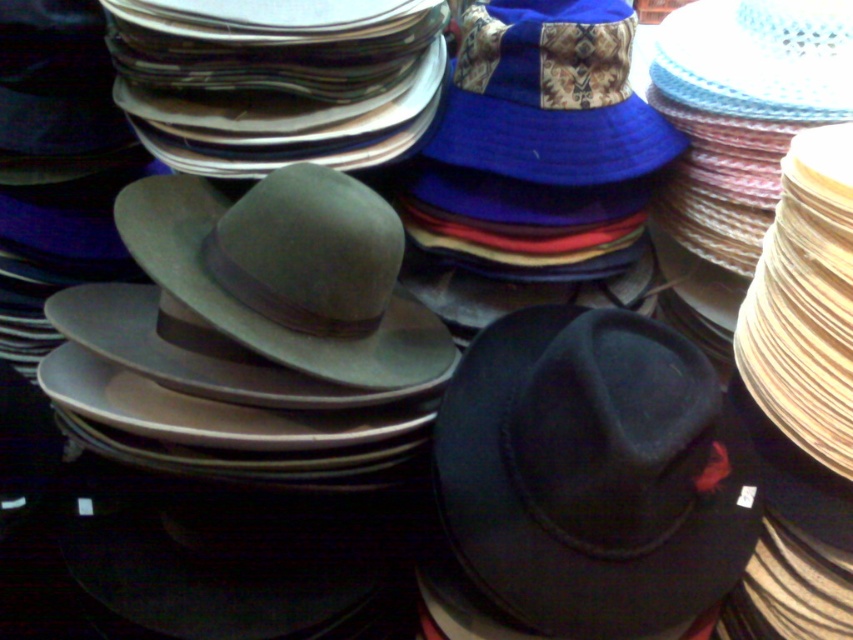
Question: Which object is farther from the camera taking this photo?

Choices:
 (A) matte green felt fedora at center
 (B) blue fabric cowboy hat at upper center
 (C) black felt cowboy hat at center

Answer: (B)

Question: Which point is closer to the camera?

Choices:
 (A) (271, 292)
 (B) (573, 141)

Answer: (A)

Question: Observing the image, what is the correct spatial positioning of black felt cowboy hat at center in reference to matte green felt fedora at center?

Choices:
 (A) above
 (B) below

Answer: (B)

Question: Is black felt cowboy hat at center further to camera compared to blue fabric cowboy hat at upper center?

Choices:
 (A) yes
 (B) no

Answer: (B)

Question: Is black felt cowboy hat at center smaller than blue fabric cowboy hat at upper center?

Choices:
 (A) no
 (B) yes

Answer: (A)

Question: Among these points, which one is nearest to the camera?

Choices:
 (A) (611, 68)
 (B) (241, 312)
 (C) (552, 589)

Answer: (C)